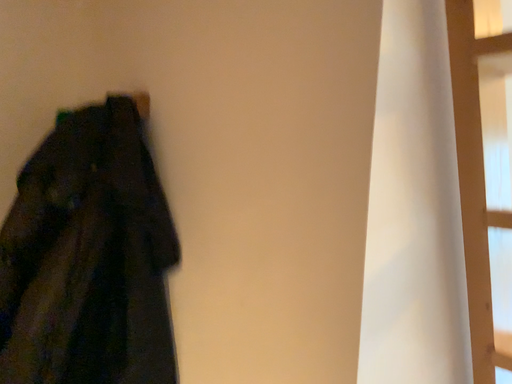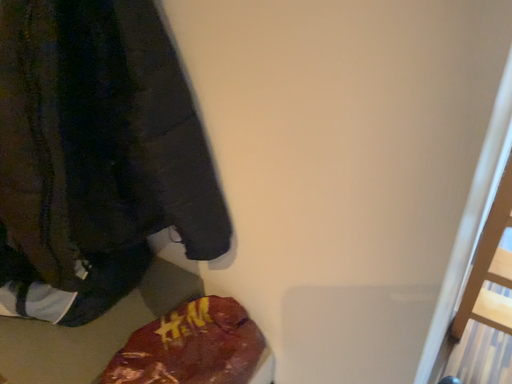
Question: Which way did the camera rotate in the video?

Choices:
 (A) rotated right
 (B) rotated left

Answer: (A)